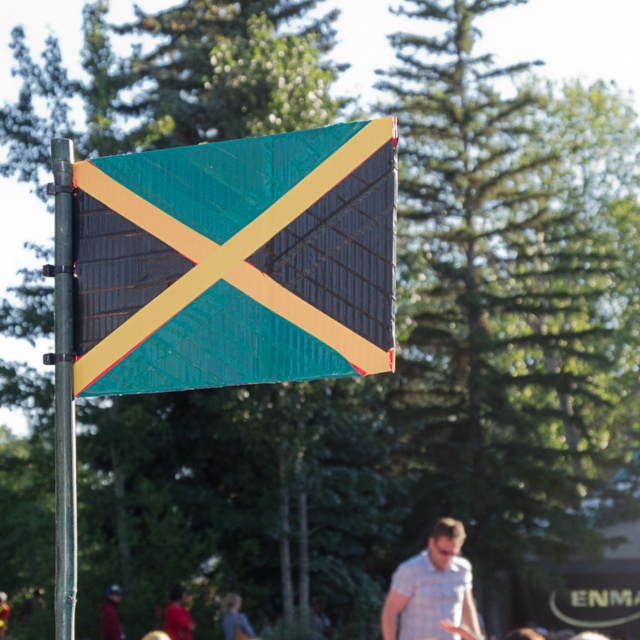
Question: Which object is positioned farthest from the matte red shirt at lower left?

Choices:
 (A) textured fabric flag at center
 (B) light blue plaid shirt at center

Answer: (A)

Question: Is metallic pole at left closer to the viewer compared to matte black shirt at center?

Choices:
 (A) yes
 (B) no

Answer: (A)

Question: Which object is the closest to the light blue plaid shirt at center?

Choices:
 (A) metallic pole at left
 (B) dark red fabric at lower left

Answer: (A)

Question: Which point appears farthest from the camera in this image?

Choices:
 (A) (227, 600)
 (B) (54, 525)
 (C) (170, 636)
 (D) (6, 616)

Answer: (D)

Question: Is textured fabric flag at center positioned behind blue denim shirt at lower center?

Choices:
 (A) no
 (B) yes

Answer: (A)

Question: Can you confirm if textured fabric flag at center is positioned to the left of blue denim shirt at lower center?

Choices:
 (A) no
 (B) yes

Answer: (A)